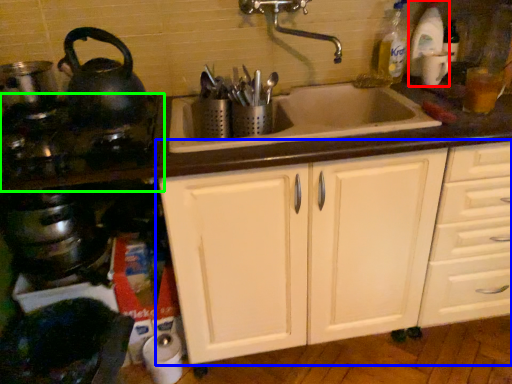
Question: Which object is positioned farthest from bottle (highlighted by a red box)? Select from cabinetry (highlighted by a blue box) and gas stove (highlighted by a green box).

Choices:
 (A) cabinetry
 (B) gas stove

Answer: (B)